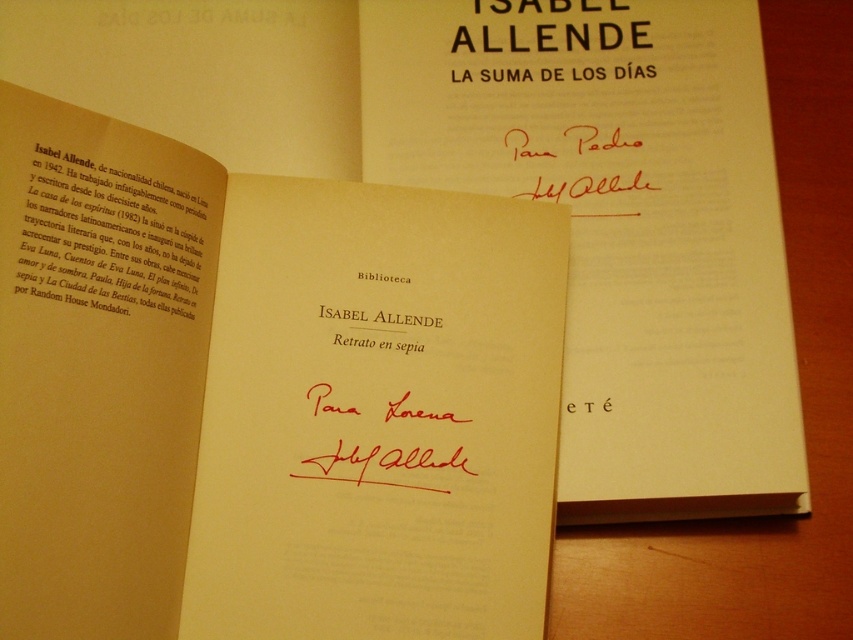
You are organizing a library shelf and need to place the sepia paper book at center and the sepia paper text at upper left. The shelf has a maximum spacing requirement of 10 centimeters between items. Can you fit both items on the shelf without violating the spacing rule?

The distance between the sepia paper book at center and the sepia paper text at upper left is 13.02 centimeters, which exceeds the 10 centimeter maximum spacing requirement. Therefore, they cannot be placed on the shelf together without violating the rule.

You are organizing a library and need to place the sepia paper book at center and the sepia paper text at upper left on a shelf. Given that the shelf has a height limit of 15 cm, can both items fit vertically without overlapping?

The sepia paper book at center is taller than the sepia paper text at upper left. However, since the exact heights are not provided, we cannot confirm if both will fit within the 15 cm height limit. More information is needed.